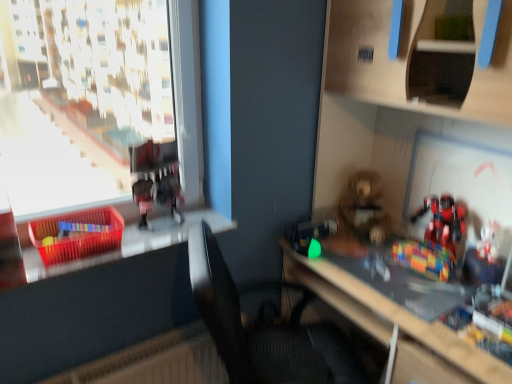
Question: From a real-world perspective, relative to black fabric chair at center, is metallic red robot at upper left, which is the 4th toy in right-to-left order, vertically above or below?

Choices:
 (A) above
 (B) below

Answer: (A)

Question: Considering the positions of metallic red robot at upper left, which is the 4th toy in right-to-left order, and black fabric chair at center in the image, is metallic red robot at upper left, which is the 4th toy in right-to-left order, bigger or smaller than black fabric chair at center?

Choices:
 (A) big
 (B) small

Answer: (B)

Question: Based on their relative distances, which object is nearer to the white plastic toy at right, marked as the first toy in a right-to-left arrangement?

Choices:
 (A) transparent plastic window at left
 (B) shiny metallic robot at right, which ranks as the second toy in right-to-left order
 (C) fuzzy brown teddy bear at center, the 2th toy from the left
 (D) black fabric chair at center
 (E) translucent plastic basket at left

Answer: (B)

Question: Considering the real-world distances, which object is closest to the translucent plastic crate at left?

Choices:
 (A) metallic red robot at upper left, placed as the 1th toy when sorted from left to right
 (B) translucent plastic basket at left
 (C) fuzzy brown teddy bear at center, the third toy in the right-to-left sequence
 (D) wooden bookshelf at lower right
 (E) white plastic toy at right, which appears as the fourth toy when viewed from the left

Answer: (B)